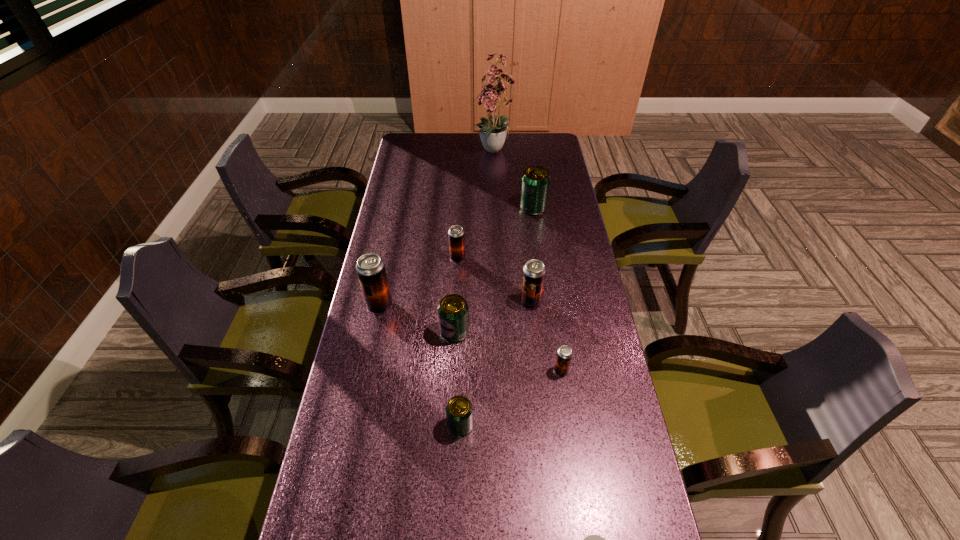
What are the coordinates of `the third nearest beer can` in the screenshot? It's located at (453, 311).

You are a GUI agent. You are given a task and a screenshot of the screen. Output one action in this format:
    pyautogui.click(x=<x>, y=<y>)
    Task: Click on the smallest green beer can
    The image size is (960, 540).
    Given the screenshot: What is the action you would take?
    point(459,411)

Identify the location of the nearest green beer can. (459, 411).

At what (x,y) coordinates should I click in order to perform the action: click on the seventh farthest object. Please return your answer as a coordinate pair (x, y). The image size is (960, 540). Looking at the image, I should click on (564, 354).

Where is `the second nearest beer can`? the second nearest beer can is located at coordinates (564, 354).

Locate an element on the screen. This screenshot has height=540, width=960. vacant space located 0.090m on the front-facing side of the flower arrangement is located at coordinates (496, 179).

Where is `vacant region located 0.090m on the back of the leftmost black beer can`? The width and height of the screenshot is (960, 540). vacant region located 0.090m on the back of the leftmost black beer can is located at coordinates click(386, 276).

Where is `vacant space located 0.200m on the back of the rightmost green beer can`? The height and width of the screenshot is (540, 960). vacant space located 0.200m on the back of the rightmost green beer can is located at coordinates (528, 173).

Locate an element on the screen. The width and height of the screenshot is (960, 540). vacant space positioned 0.130m on the left of the second black beer can from right to left is located at coordinates (480, 302).

Where is `free space located 0.110m on the back of the farthest black beer can`? This screenshot has height=540, width=960. free space located 0.110m on the back of the farthest black beer can is located at coordinates (459, 233).